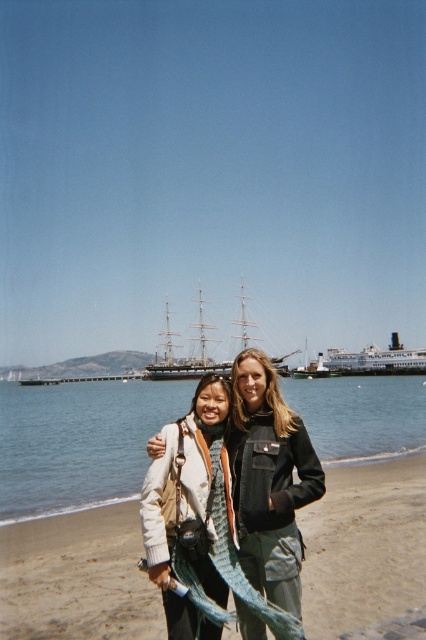
Question: Considering the real-world distances, which object is farthest from the wooden ship at center?

Choices:
 (A) blue water at center
 (B) teal fabric scarf at center
 (C) sandy brown at lower center

Answer: (B)

Question: Which of the following is the closest to the observer?

Choices:
 (A) wooden ship at center
 (B) white glossy ferry at center
 (C) blue water at center
 (D) sandy brown at lower center

Answer: (D)

Question: Is sandy brown at lower center to the right of teal fabric scarf at center from the viewer's perspective?

Choices:
 (A) yes
 (B) no

Answer: (A)

Question: Which point is farther to the camera?

Choices:
 (A) (360, 513)
 (B) (419, 362)

Answer: (B)

Question: Can you confirm if blue water at center is wider than white fleece jacket at center?

Choices:
 (A) no
 (B) yes

Answer: (B)

Question: Does sandy brown at lower center lie behind teal fabric scarf at center?

Choices:
 (A) yes
 (B) no

Answer: (A)